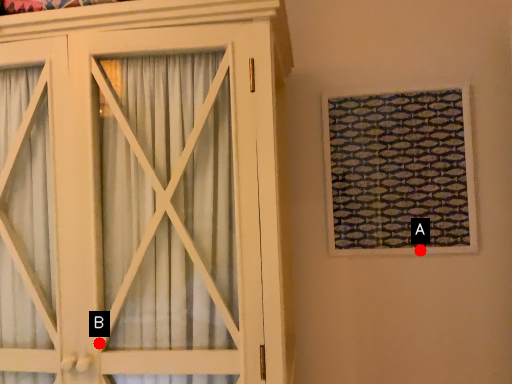
Question: Two points are circled on the image, labeled by A and B beside each circle. Which point is further to the camera?

Choices:
 (A) A is further
 (B) B is further

Answer: (A)